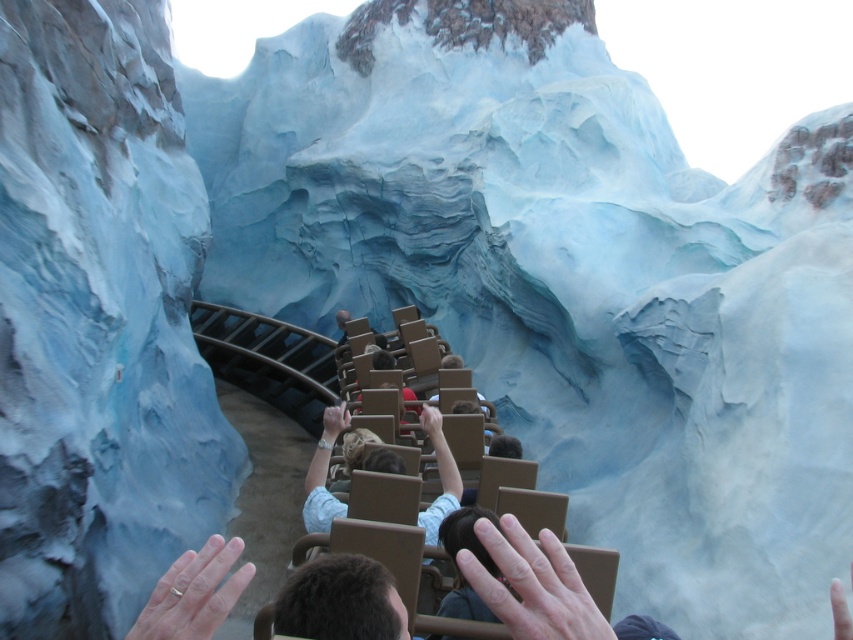
Question: Is smooth skin hand at center bigger than matte brown hand at center?

Choices:
 (A) yes
 (B) no

Answer: (B)

Question: Which point is closer to the camera?

Choices:
 (A) (190, 598)
 (B) (273, 404)

Answer: (A)

Question: Does light brown leather jacket at center appear under matte brown hand at center?

Choices:
 (A) yes
 (B) no

Answer: (A)

Question: Is dark brown hair at center to the left of light skin tone flesh at center from the viewer's perspective?

Choices:
 (A) yes
 (B) no

Answer: (B)

Question: Which of the following is the farthest from the observer?

Choices:
 (A) gold metallic ring at center
 (B) light brown leather jacket at center
 (C) matte brown hand at center
 (D) smooth skin hand at center

Answer: (C)

Question: Which point appears farthest from the camera in this image?

Choices:
 (A) (329, 420)
 (B) (469, 554)

Answer: (A)